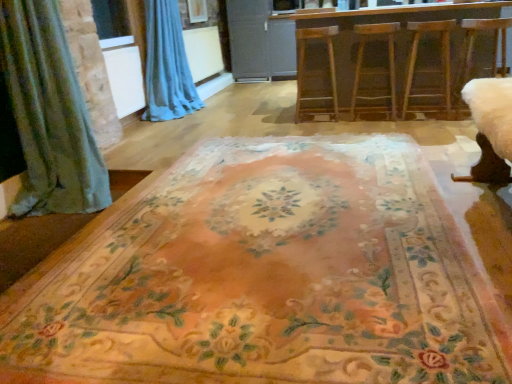
Question: Can you confirm if white fabric swivel chair at right is wider than wooden barstools at center?

Choices:
 (A) no
 (B) yes

Answer: (A)

Question: Does white fabric swivel chair at right lie behind wooden barstools at center?

Choices:
 (A) no
 (B) yes

Answer: (A)

Question: Is white fabric swivel chair at right positioned far away from wooden barstools at center?

Choices:
 (A) no
 (B) yes

Answer: (A)

Question: Considering the relative sizes of white fabric swivel chair at right and wooden barstools at center in the image provided, is white fabric swivel chair at right taller than wooden barstools at center?

Choices:
 (A) yes
 (B) no

Answer: (B)

Question: Is white fabric swivel chair at right placed right next to wooden barstools at center?

Choices:
 (A) no
 (B) yes

Answer: (A)

Question: Is floral carpet at center to the left or to the right of white fabric swivel chair at right in the image?

Choices:
 (A) left
 (B) right

Answer: (A)

Question: Considering the positions of floral carpet at center and white fabric swivel chair at right in the image, is floral carpet at center bigger or smaller than white fabric swivel chair at right?

Choices:
 (A) big
 (B) small

Answer: (A)

Question: From the image's perspective, is floral carpet at center positioned above or below white fabric swivel chair at right?

Choices:
 (A) below
 (B) above

Answer: (A)

Question: Considering the positions of floral carpet at center and white fabric swivel chair at right in the image, is floral carpet at center taller or shorter than white fabric swivel chair at right?

Choices:
 (A) short
 (B) tall

Answer: (A)

Question: Is white fabric swivel chair at right to the left or to the right of clear plastic window screen at upper left in the image?

Choices:
 (A) left
 (B) right

Answer: (B)

Question: Is point (462, 79) closer or farther from the camera than point (117, 6)?

Choices:
 (A) farther
 (B) closer

Answer: (B)

Question: From a real-world perspective, is white fabric swivel chair at right physically located above or below clear plastic window screen at upper left?

Choices:
 (A) below
 (B) above

Answer: (A)

Question: In the image, is white fabric swivel chair at right positioned in front of or behind clear plastic window screen at upper left?

Choices:
 (A) behind
 (B) front

Answer: (B)

Question: Relative to white fabric swivel chair at right, is wooden barstools at center in front or behind?

Choices:
 (A) behind
 (B) front

Answer: (A)

Question: Is wooden barstools at center taller or shorter than white fabric swivel chair at right?

Choices:
 (A) tall
 (B) short

Answer: (A)